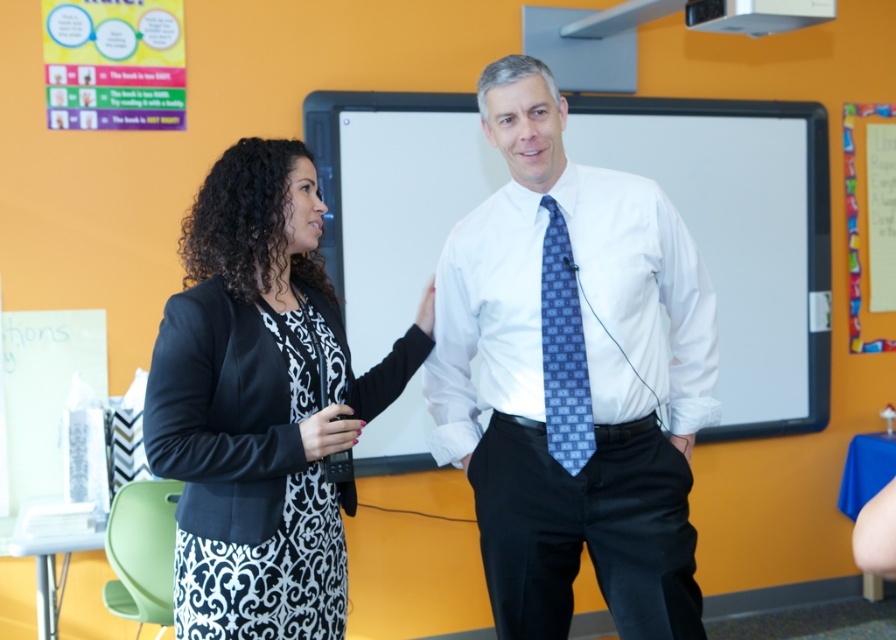
You are a student sitting in the classroom. You need to write something on the whiteboard at center and also adjust the blue patterned tie at center. Which object is easier to reach?

The blue patterned tie at center is easier to reach because it is much shorter than the whiteboard at center.

Looking at this image, you are a student sitting in the classroom and want to know which of the two points, point (x=385, y=92) or point (x=550, y=364), is closer to you. Can you determine this based on their positions?

Point (x=385, y=92) is closer to you because it is further to the viewer than point (x=550, y=364).

You are a student sitting in the classroom and looking at the two individuals at the front. Which clothing item, the white smooth shirt at center or the black matte blazer at center, is closer to you?

The white smooth shirt at center is closer to you because the black matte blazer at center is behind it.